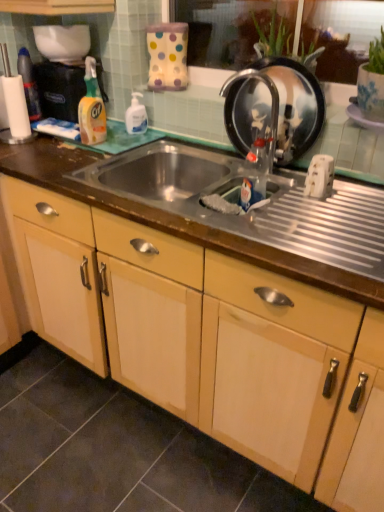
Question: Does translucent plastic bottle at center, which is counted as the 2th bottle, starting from the left, have a lesser width compared to translucent plastic bottle at upper left, which is counted as the 1th bottle, starting from the left?

Choices:
 (A) yes
 (B) no

Answer: (B)

Question: From a real-world perspective, is translucent plastic bottle at center, arranged as the 1th bottle when viewed from the right, physically below translucent plastic bottle at upper left, which appears as the 1th bottle when viewed from the back?

Choices:
 (A) no
 (B) yes

Answer: (B)

Question: Can you confirm if translucent plastic bottle at center, which is the 2th bottle in top-to-bottom order, is taller than translucent plastic bottle at upper left, which is the first bottle from top to bottom?

Choices:
 (A) yes
 (B) no

Answer: (B)

Question: Can you confirm if translucent plastic bottle at center, arranged as the 1th bottle when viewed from the front, is positioned to the left of translucent plastic bottle at upper left, which is counted as the 1th bottle, starting from the left?

Choices:
 (A) no
 (B) yes

Answer: (A)

Question: Is translucent plastic bottle at center, arranged as the 1th bottle when viewed from the right, with translucent plastic bottle at upper left, which is counted as the 1th bottle, starting from the left?

Choices:
 (A) no
 (B) yes

Answer: (A)

Question: In terms of height, does white glossy pump bottle at upper center, the second cleaning product viewed from the left, look taller or shorter compared to yellow plastic spray bottle at left, acting as the first cleaning product starting from the left?

Choices:
 (A) short
 (B) tall

Answer: (A)

Question: Considering the positions of point (135, 108) and point (99, 108), is point (135, 108) closer or farther from the camera than point (99, 108)?

Choices:
 (A) farther
 (B) closer

Answer: (A)

Question: Considering the relative positions of white glossy pump bottle at upper center, the second cleaning product viewed from the left, and yellow plastic spray bottle at left, acting as the first cleaning product starting from the left, in the image provided, is white glossy pump bottle at upper center, the second cleaning product viewed from the left, to the left or to the right of yellow plastic spray bottle at left, acting as the first cleaning product starting from the left,?

Choices:
 (A) right
 (B) left

Answer: (A)

Question: Considering the positions of white glossy pump bottle at upper center, the second cleaning product viewed from the left, and yellow plastic spray bottle at left, acting as the first cleaning product starting from the left, in the image, is white glossy pump bottle at upper center, the second cleaning product viewed from the left, bigger or smaller than yellow plastic spray bottle at left, acting as the first cleaning product starting from the left,?

Choices:
 (A) small
 (B) big

Answer: (A)

Question: From a real-world perspective, is translucent plastic bottle at upper left, arranged as the 2th bottle when viewed from the right, above or below yellow plastic spray bottle at left, acting as the first cleaning product starting from the left?

Choices:
 (A) above
 (B) below

Answer: (A)

Question: Considering their positions, is translucent plastic bottle at upper left, which is counted as the 1th bottle, starting from the left, located in front of or behind yellow plastic spray bottle at left, the 2th cleaning product positioned from the right?

Choices:
 (A) front
 (B) behind

Answer: (B)

Question: Does point (26, 68) appear closer or farther from the camera than point (92, 83)?

Choices:
 (A) farther
 (B) closer

Answer: (A)

Question: From the image's perspective, is translucent plastic bottle at upper left, arranged as the 2th bottle when viewed from the right, positioned above or below yellow plastic spray bottle at left, the 2th cleaning product positioned from the right?

Choices:
 (A) above
 (B) below

Answer: (A)

Question: Considering the positions of polka dot fabric bag at upper center, acting as the 1th appliance starting from the top, and translucent plastic bottle at center, which is the 2th bottle in top-to-bottom order, in the image, is polka dot fabric bag at upper center, acting as the 1th appliance starting from the top, wider or thinner than translucent plastic bottle at center, which is the 2th bottle in top-to-bottom order,?

Choices:
 (A) thin
 (B) wide

Answer: (B)

Question: Is polka dot fabric bag at upper center, the second appliance from the bottom, bigger or smaller than translucent plastic bottle at center, arranged as the 1th bottle when viewed from the right?

Choices:
 (A) small
 (B) big

Answer: (B)